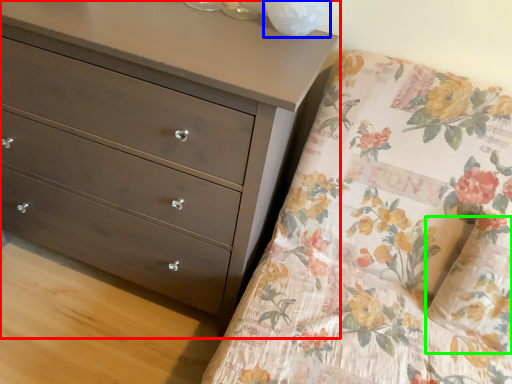
Question: Which object is the closest to the chest of drawers (highlighted by a red box)? Choose among these: glass vase (highlighted by a blue box) or pillow (highlighted by a green box).

Choices:
 (A) glass vase
 (B) pillow

Answer: (A)